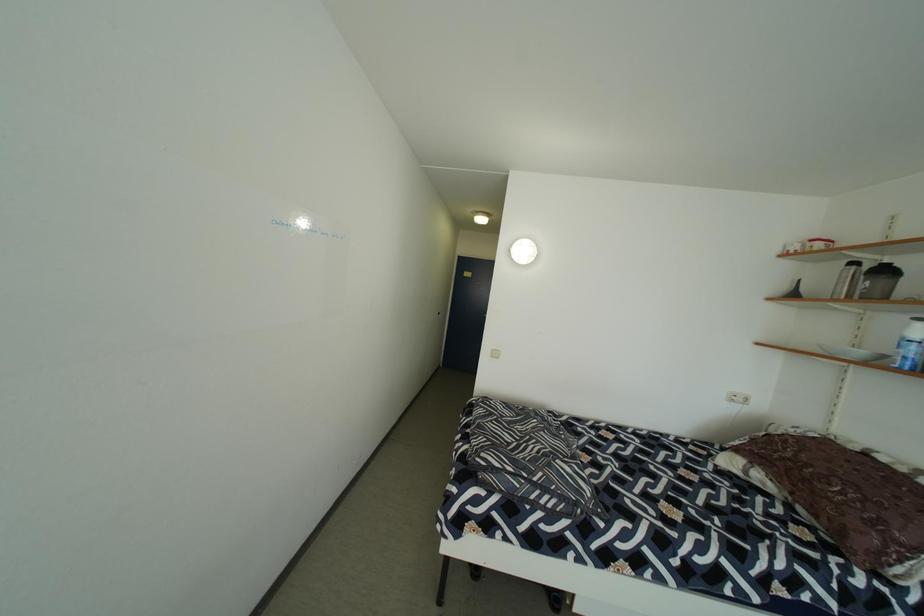
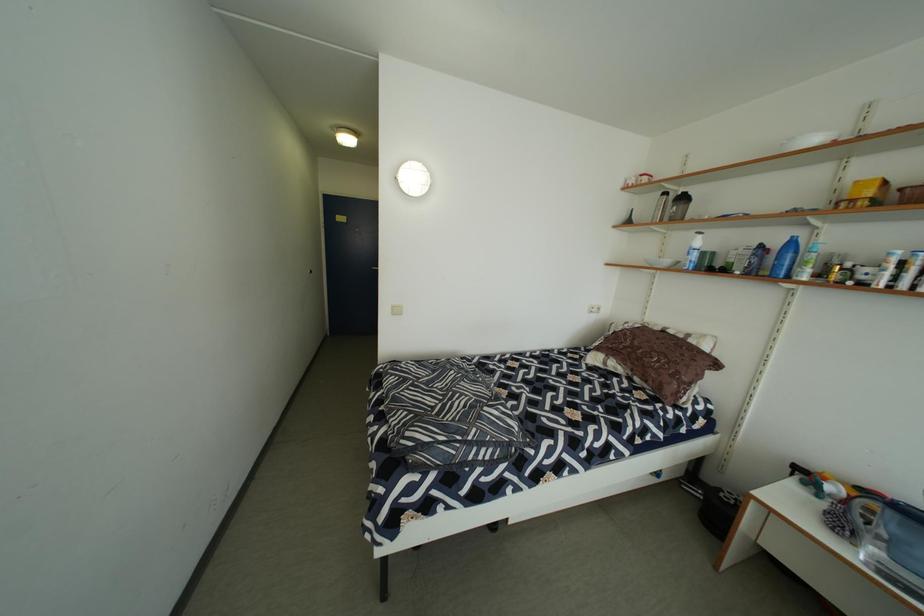
Question: The camera is either moving clockwise (left) or counter-clockwise (right) around the object. The first image is from the beginning of the video and the second image is from the end. Is the camera moving left or right when shooting the video?

Choices:
 (A) Left
 (B) Right

Answer: (A)